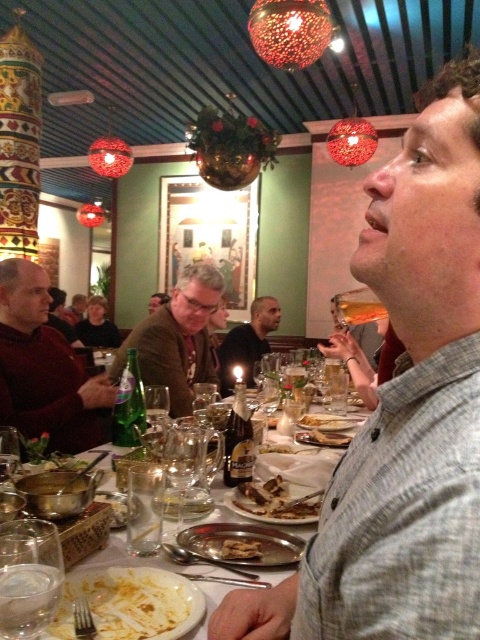
Question: Which point appears closest to the camera in this image?

Choices:
 (A) (296, 464)
 (B) (24, 586)
 (C) (117, 596)

Answer: (B)

Question: Which of the following is the farthest from the observer?

Choices:
 (A) silver metallic platter at center
 (B) golden crispy bread at center
 (C) gray textured shirt at center

Answer: (B)

Question: Can you confirm if matte brown jacket at center is smaller than golden crispy chicken at center?

Choices:
 (A) no
 (B) yes

Answer: (A)

Question: Can you confirm if metallic silver plate at center is positioned to the left of golden crispy bread at center?

Choices:
 (A) yes
 (B) no

Answer: (A)

Question: Which object is closer to the camera taking this photo?

Choices:
 (A) metallic silver plate at center
 (B) golden crispy pastry at center
 (C) dark red sweater at left
 (D) matte brown jacket at center

Answer: (A)

Question: Is brown textured sweater at center smaller than golden crispy bread at center?

Choices:
 (A) no
 (B) yes

Answer: (A)